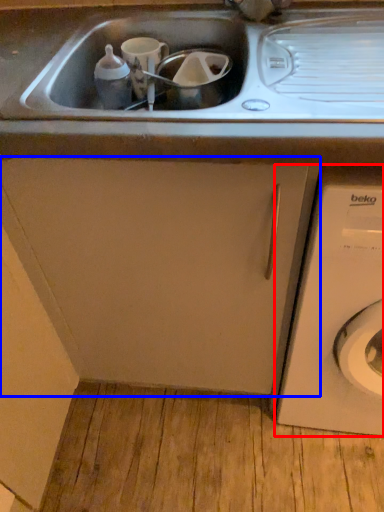
Question: Which of the following is the farthest to the observer, washing machine (highlighted by a red box) or cabinetry (highlighted by a blue box)?

Choices:
 (A) washing machine
 (B) cabinetry

Answer: (B)